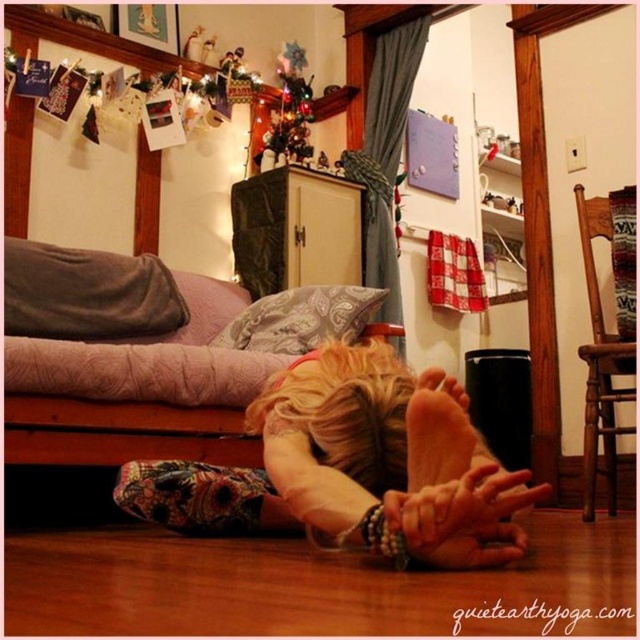
Question: Does velvety gray pillow at upper left have a smaller size compared to paisley-patterned fabric pillow at lower center?

Choices:
 (A) no
 (B) yes

Answer: (A)

Question: Among these objects, which one is nearest to the camera?

Choices:
 (A) blonde hair at lower center
 (B) velvety gray pillow at upper left

Answer: (A)

Question: Is velvety gray pillow at upper left thinner than paisley-patterned fabric pillow at lower center?

Choices:
 (A) no
 (B) yes

Answer: (B)

Question: Estimate the real-world distances between objects in this image. Which object is closer to the blonde hair at lower center?

Choices:
 (A) velvety gray pillow at upper left
 (B) paisley-patterned fabric pillow at lower center

Answer: (B)

Question: Considering the relative positions of blonde hair at lower center and velvety gray pillow at upper left in the image provided, where is blonde hair at lower center located with respect to velvety gray pillow at upper left?

Choices:
 (A) left
 (B) right

Answer: (B)

Question: Which object appears farthest from the camera in this image?

Choices:
 (A) blonde hair at lower center
 (B) velvety gray pillow at upper left

Answer: (B)